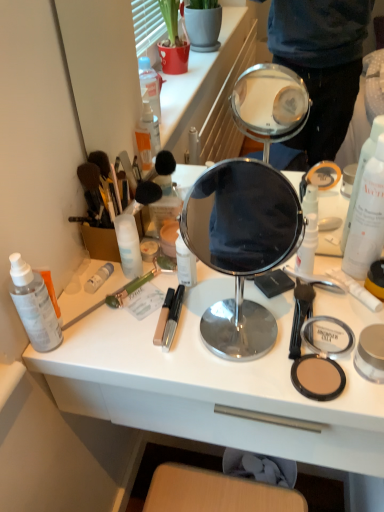
I want to click on free point in front of white matte pump bottle at right, acting as the 5th toiletry starting from the left, so click(290, 334).